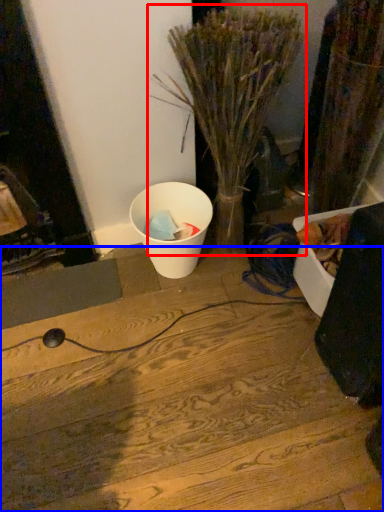
Question: Which object is closer to the camera taking this photo, houseplant (highlighted by a red box) or wood (highlighted by a blue box)?

Choices:
 (A) houseplant
 (B) wood

Answer: (A)